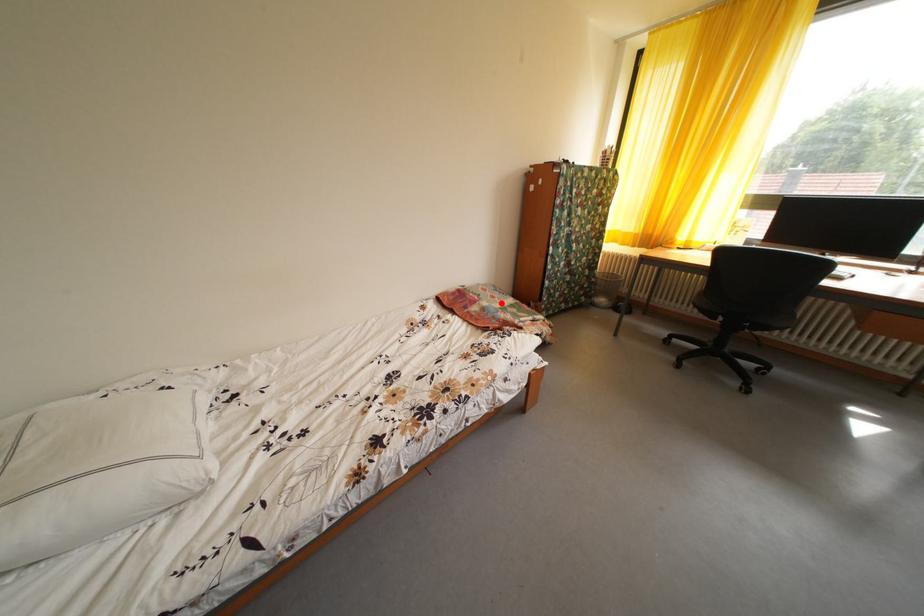
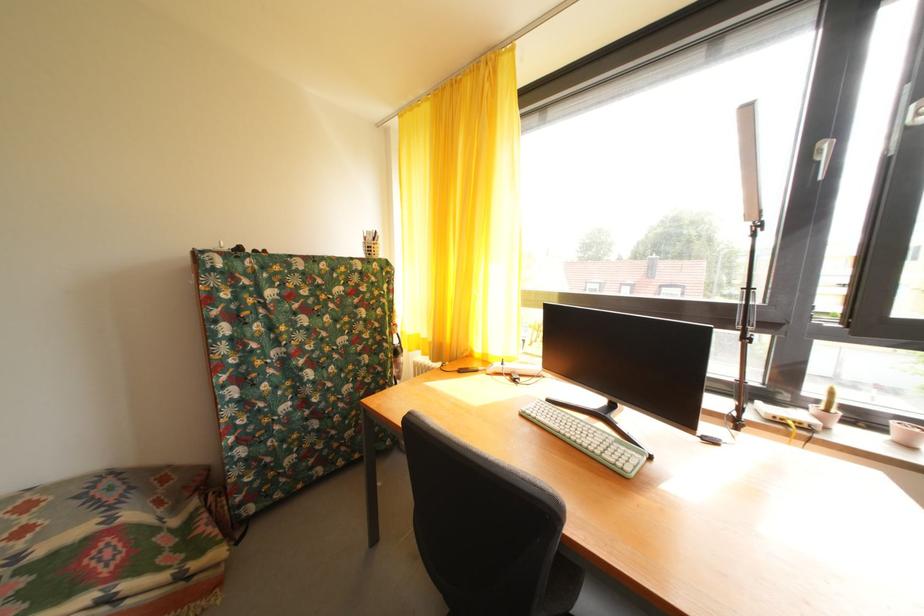
In the second image, find the point that corresponds to the highlighted location in the first image.

(31, 538)